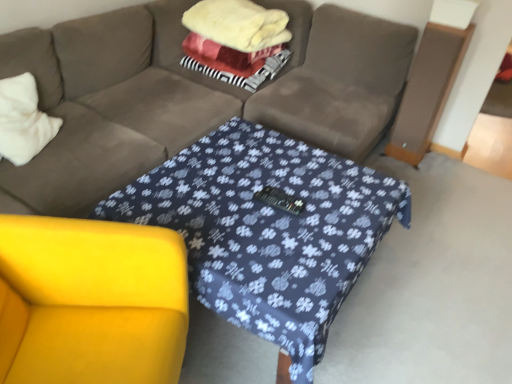
In the scene shown: What is the approximate height of fluffy white blanket at center?

The height of fluffy white blanket at center is 43.46 centimeters.

Identify the location of yellow fabric armchair at lower left. (94, 301).

From a real-world perspective, between yellow fabric armchair at lower left and white soft pillow at left, who is vertically higher?

white soft pillow at left, from a real-world perspective.

Locate an element on the screen. The image size is (512, 384). armchair that is below the white soft pillow at left (from the image's perspective) is located at coordinates (94, 301).

Can you tell me how much yellow fabric armchair at lower left and white soft pillow at left differ in facing direction?

There is a 10.6-degree angle between the facing directions of yellow fabric armchair at lower left and white soft pillow at left.

Is point (74, 282) positioned before point (0, 91)?

Yes, point (74, 282) is in front of point (0, 91).

Which of these two, white soft pillow at left or yellow fabric armchair at lower left, is smaller?

With smaller size is white soft pillow at left.

From the image's perspective, between white soft pillow at left and yellow fabric armchair at lower left, which one is located above?

white soft pillow at left is shown above in the image.

Find the location of `throw pillow lying behind the yellow fabric armchair at lower left`. throw pillow lying behind the yellow fabric armchair at lower left is located at coordinates (23, 120).

Considering the relative sizes of white soft pillow at left and yellow fabric armchair at lower left in the image provided, is white soft pillow at left thinner than yellow fabric armchair at lower left?

Correct, the width of white soft pillow at left is less than that of yellow fabric armchair at lower left.

Is fluffy white blanket at center turned away from white soft pillow at left?

No, fluffy white blanket at center is not facing the opposite direction of white soft pillow at left.

Considering the positions of objects fluffy white blanket at center and white soft pillow at left in the image provided, who is in front, fluffy white blanket at center or white soft pillow at left?

white soft pillow at left is more forward.

From a real-world perspective, is fluffy white blanket at center located higher than white soft pillow at left?

Yes, from a real-world perspective, fluffy white blanket at center is over white soft pillow at left

Choose the correct answer: Is fluffy white blanket at center inside white soft pillow at left or outside it?

fluffy white blanket at center cannot be found inside white soft pillow at left.

Is fluffy white blanket at center inside yellow fabric armchair at lower left?

Actually, fluffy white blanket at center is outside yellow fabric armchair at lower left.

From the image's perspective, would you say yellow fabric armchair at lower left is positioned over fluffy white blanket at center?

No, from the image's perspective, yellow fabric armchair at lower left is not over fluffy white blanket at center.

Which object is closer to the camera, yellow fabric armchair at lower left or fluffy white blanket at center?

yellow fabric armchair at lower left is in front.

Between yellow fabric armchair at lower left and fluffy white blanket at center, which one has larger size?

With larger size is yellow fabric armchair at lower left.

Could you tell me if white soft pillow at left is turned towards fluffy white blanket at center?

No, white soft pillow at left is not facing towards fluffy white blanket at center.

Considering the relative sizes of white soft pillow at left and fluffy white blanket at center in the image provided, is white soft pillow at left shorter than fluffy white blanket at center?

Yes.

Considering the positions of points (28, 103) and (204, 31), is point (28, 103) farther from camera compared to point (204, 31)?

No, (28, 103) is in front of (204, 31).

Considering the sizes of objects white soft pillow at left and fluffy white blanket at center in the image provided, who is wider, white soft pillow at left or fluffy white blanket at center?

fluffy white blanket at center.

Which is in front, point (218, 41) or point (156, 265)?

Positioned in front is point (156, 265).

Does fluffy white blanket at center have a lesser height compared to yellow fabric armchair at lower left?

Indeed, fluffy white blanket at center has a lesser height compared to yellow fabric armchair at lower left.

How much distance is there between fluffy white blanket at center and yellow fabric armchair at lower left?

fluffy white blanket at center and yellow fabric armchair at lower left are 1.77 meters apart from each other.

You are a GUI agent. You are given a task and a screenshot of the screen. Output one action in this format:
    pyautogui.click(x=<x>, y=<y>)
    Task: Click on the armchair in front of the fluffy white blanket at center
    This screenshot has height=384, width=512.
    Given the screenshot: What is the action you would take?
    pyautogui.click(x=94, y=301)

You are a GUI agent. You are given a task and a screenshot of the screen. Output one action in this format:
    pyautogui.click(x=<x>, y=<y>)
    Task: Click on the armchair in front of the white soft pillow at left
    The image size is (512, 384).
    Given the screenshot: What is the action you would take?
    pyautogui.click(x=94, y=301)

The height and width of the screenshot is (384, 512). In order to click on armchair that appears below the white soft pillow at left (from the image's perspective) in this screenshot , I will do `click(94, 301)`.

Estimate the real-world distances between objects in this image. Which object is closer to yellow fabric armchair at lower left, white soft pillow at left or fluffy white blanket at center?

The object closer to yellow fabric armchair at lower left is white soft pillow at left.

When comparing their distances from white soft pillow at left, does fluffy white blanket at center or yellow fabric armchair at lower left seem closer?

Among the two, yellow fabric armchair at lower left is located nearer to white soft pillow at left.

Which object lies nearer to the anchor point yellow fabric armchair at lower left, fluffy white blanket at center or white soft pillow at left?

white soft pillow at left lies closer to yellow fabric armchair at lower left than the other object.

Estimate the real-world distances between objects in this image. Which object is closer to fluffy white blanket at center, yellow fabric armchair at lower left or white soft pillow at left?

white soft pillow at left.

Estimate the real-world distances between objects in this image. Which object is further from white soft pillow at left, yellow fabric armchair at lower left or fluffy white blanket at center?

The object further to white soft pillow at left is fluffy white blanket at center.

Considering their positions, is white soft pillow at left positioned closer to fluffy white blanket at center than yellow fabric armchair at lower left?

white soft pillow at left.

Locate an element on the screen. Image resolution: width=512 pixels, height=384 pixels. throw pillow that lies between fluffy white blanket at center and yellow fabric armchair at lower left from top to bottom is located at coordinates (23, 120).